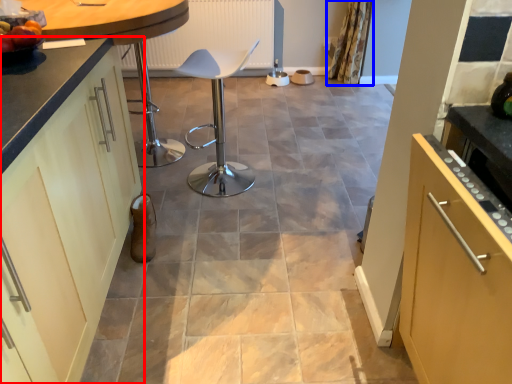
Question: Among these objects, which one is farthest to the camera, cabinetry (highlighted by a red box) or curtain (highlighted by a blue box)?

Choices:
 (A) cabinetry
 (B) curtain

Answer: (B)